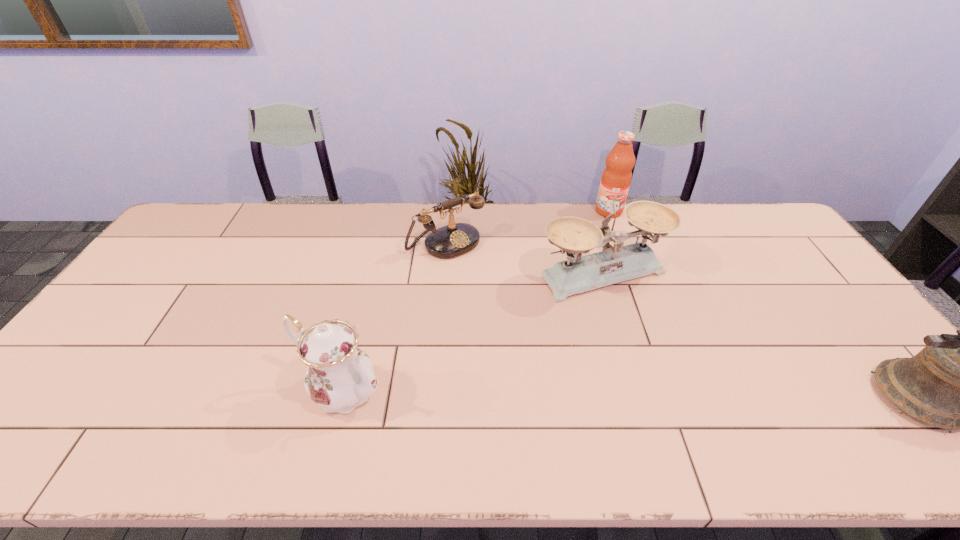
Identify the location of vacant space located 0.380m on the front-facing side of the scale. (727, 411).

Identify the location of blank space located 0.160m on the front-facing side of the scale. This screenshot has height=540, width=960. 668,342.

Find the location of a particular element. vacant space located on the front label of the tallest object is located at coordinates (602, 264).

Identify the location of free space located on the front label of the tallest object. This screenshot has height=540, width=960. click(605, 245).

You are a GUI agent. You are given a task and a screenshot of the screen. Output one action in this format:
    pyautogui.click(x=<x>, y=<y>)
    Task: Click on the free space located on the front label of the tallest object
    
    Given the screenshot: What is the action you would take?
    pyautogui.click(x=607, y=226)

At what (x,y) coordinates should I click in order to perform the action: click on telephone located in the far edge section of the desktop. Please return your answer as a coordinate pair (x, y). This screenshot has height=540, width=960. Looking at the image, I should click on (455, 239).

What are the coordinates of `fruit juice that is at the far edge` in the screenshot? It's located at (616, 177).

This screenshot has height=540, width=960. I want to click on object that is at the near edge, so click(339, 377).

Where is `vacant region at the far edge`? This screenshot has height=540, width=960. vacant region at the far edge is located at coordinates (352, 243).

In the image, there is a desktop. Where is `vacant area at the near edge`? The height and width of the screenshot is (540, 960). vacant area at the near edge is located at coordinates (245, 410).